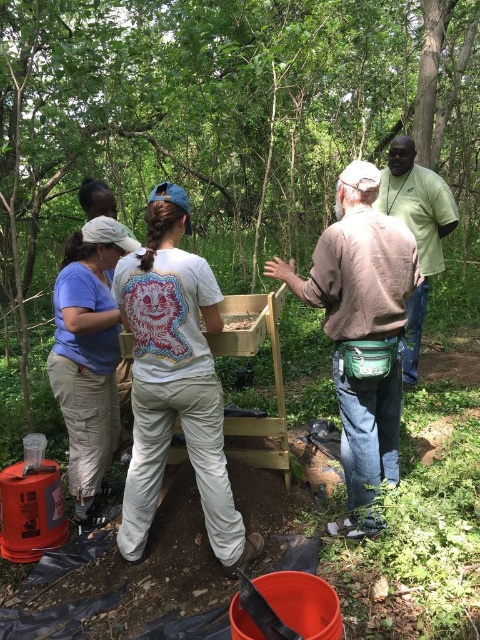
You are standing in the wooded area and want to move from point (133, 332) to point (418, 300). Which direction should you move to get closer to the second point?

You should move backward because point (133, 332) is closer to the viewer than point (418, 300), so moving backward will take you towards the latter.

You are a photographer trying to capture a clear shot of the matte wooden box at center without the green fabric shirt at upper right blocking it. Based on their relative heights, which object should you focus on to ensure the shirt doesn not obstruct the view?

The green fabric shirt at upper right is taller than the matte wooden box at center, so focusing on the matte wooden box at center and angling the camera downward might help avoid the obstruction from the shirt.

Based on the scene description, where is the white cotton shirt at center located in terms of its 2D coordinates?

The white cotton shirt at center is located at the 2D coordinates point (175, 381).